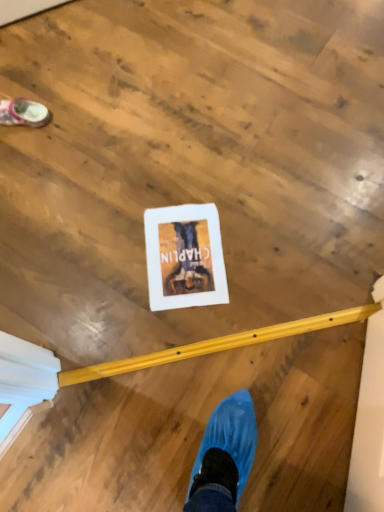
At what (x,y) coordinates should I click in order to perform the action: click on white fabric shoe at upper left. Please return your answer as a coordinate pair (x, y). Looking at the image, I should click on (23, 113).

Image resolution: width=384 pixels, height=512 pixels. Describe the element at coordinates (23, 113) in the screenshot. I see `white fabric shoe at upper left` at that location.

You are a GUI agent. You are given a task and a screenshot of the screen. Output one action in this format:
    pyautogui.click(x=<x>, y=<y>)
    Task: Click on the white paper at center
    The image size is (384, 512).
    Given the screenshot: What is the action you would take?
    pyautogui.click(x=184, y=257)

What do you see at coordinates (184, 257) in the screenshot? I see `white paper at center` at bounding box center [184, 257].

What is the approximate width of white paper at center?

white paper at center is 11.99 inches in width.

I want to click on white fabric shoe at upper left, so click(23, 113).

Is white fabric shoe at upper left at the left side of white paper at center?

Yes, white fabric shoe at upper left is to the left of white paper at center.

In the image, is white fabric shoe at upper left positioned in front of or behind white paper at center?

Result: Clearly, white fabric shoe at upper left is behind white paper at center.

Considering the points (35, 127) and (194, 257), which point is in front, point (35, 127) or point (194, 257)?

Positioned in front is point (194, 257).

From the image's perspective, which one is positioned higher, white fabric shoe at upper left or white paper at center?

From the image's view, white fabric shoe at upper left is above.

From a real-world perspective, is white fabric shoe at upper left beneath white paper at center?

Actually, white fabric shoe at upper left is physically above white paper at center in the real world.

Is white fabric shoe at upper left thinner than white paper at center?

Correct, the width of white fabric shoe at upper left is less than that of white paper at center.

Based on the photo, who is taller, white fabric shoe at upper left or white paper at center?

white fabric shoe at upper left is taller.

Is white fabric shoe at upper left bigger or smaller than white paper at center?

Considering their sizes, white fabric shoe at upper left takes up more space than white paper at center.

Is white fabric shoe at upper left surrounding white paper at center?

No, white paper at center is not a part of white fabric shoe at upper left.

Is white fabric shoe at upper left not near white paper at center?

No.

Is white fabric shoe at upper left oriented away from white paper at center?

white fabric shoe at upper left does not have its back to white paper at center.

How many degrees apart are the facing directions of white fabric shoe at upper left and white paper at center?

15 degrees.

Measure the distance from white fabric shoe at upper left to white paper at center.

white fabric shoe at upper left is 59.98 centimeters from white paper at center.

I want to click on postcard below the white fabric shoe at upper left (from a real-world perspective), so click(x=184, y=257).

Which is more to the right, white paper at center or white fabric shoe at upper left?

From the viewer's perspective, white paper at center appears more on the right side.

Is the position of white paper at center less distant than that of white fabric shoe at upper left?

Yes.

Considering the points (159, 222) and (25, 99), which point is behind, point (159, 222) or point (25, 99)?

The point (25, 99) is behind.

From the image's perspective, would you say white paper at center is positioned over white fabric shoe at upper left?

No, from the image's perspective, white paper at center is not over white fabric shoe at upper left.

From a real-world perspective, who is located lower, white paper at center or white fabric shoe at upper left?

white paper at center, from a real-world perspective.

Does white paper at center have a lesser width compared to white fabric shoe at upper left?

No.

In terms of height, does white paper at center look taller or shorter compared to white fabric shoe at upper left?

Considering their sizes, white paper at center has less height than white fabric shoe at upper left.

Between white paper at center and white fabric shoe at upper left, which one has smaller size?

white paper at center.

Do you think white paper at center is within white fabric shoe at upper left, or outside of it?

white paper at center exists outside the volume of white fabric shoe at upper left.

Is white paper at center next to white fabric shoe at upper left?

No, white paper at center is not next to white fabric shoe at upper left.

Does white paper at center turn towards white fabric shoe at upper left?

No, white paper at center is not aimed at white fabric shoe at upper left.

Can you tell me how much white paper at center and white fabric shoe at upper left differ in facing direction?

The angular difference between white paper at center and white fabric shoe at upper left is 15 degrees.

I want to click on footwear on the left of the white paper at center, so click(23, 113).

Find the location of a particular element. The width and height of the screenshot is (384, 512). footwear behind the white paper at center is located at coordinates coord(23,113).

The width and height of the screenshot is (384, 512). I want to click on footwear on the left of white paper at center, so click(x=23, y=113).